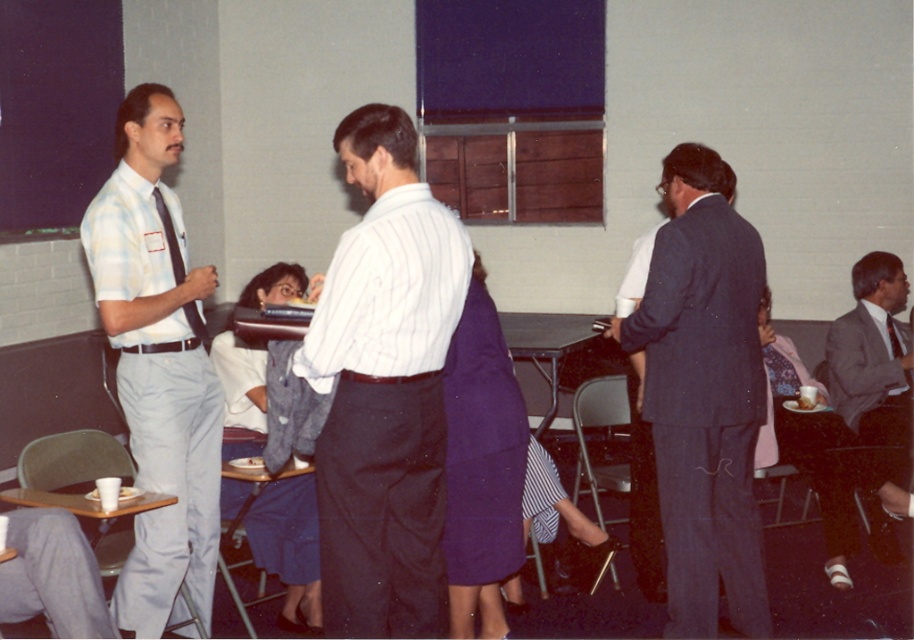
You are organizing a photo shoot and need to arrange two outfits for a photoshoot setup. The outfits are the white fabric dress at center and the gray suit jacket at lower right. Which outfit should be placed higher up in the display rack to match their sizes?

The white fabric dress at center should be placed higher up in the display rack since it is taller than the gray suit jacket at lower right.

In the scene shown: You are standing in the conference room and want to reach a specific point in the room. The point is located at coordinates point (256, 369). If you are currently 10 feet away from that point, how much further do you need to move to reach it?

The distance of point (256, 369) from viewer is 13.85 feet. Since you are currently 10 feet away from that point, you need to move an additional 3.85 feet to reach it.

In the scene shown: You are standing at the entrance of the conference room and see two points marked in the scene. Which point is closer to you, point (303, 588) or point (862, 387)?

Point (303, 588) is closer to the viewer than point (862, 387).